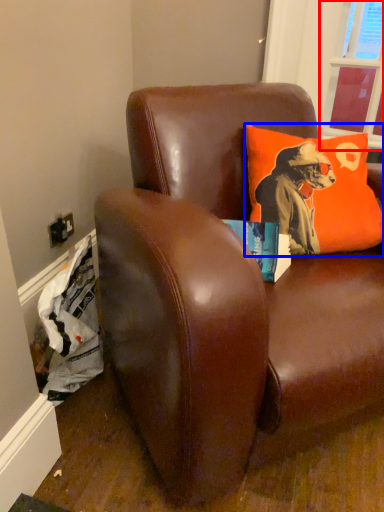
Question: Which of the following is the farthest to the observer, window screen (highlighted by a red box) or pillow (highlighted by a blue box)?

Choices:
 (A) window screen
 (B) pillow

Answer: (A)